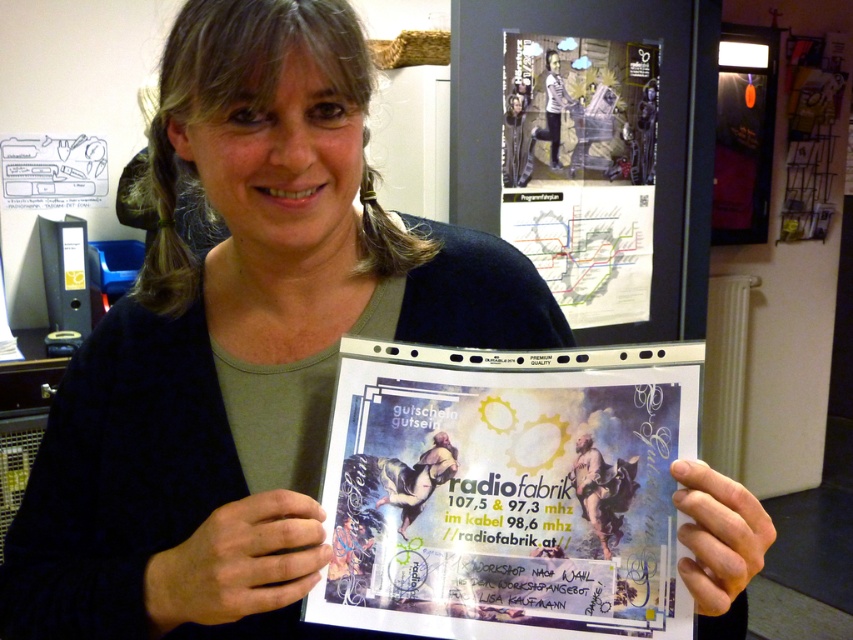
Does point (403, 362) lie behind point (654, 125)?

No, (403, 362) is closer to viewer.

What do you see at coordinates (508, 492) in the screenshot? I see `white paper poster at center` at bounding box center [508, 492].

The height and width of the screenshot is (640, 853). I want to click on white paper poster at center, so click(508, 492).